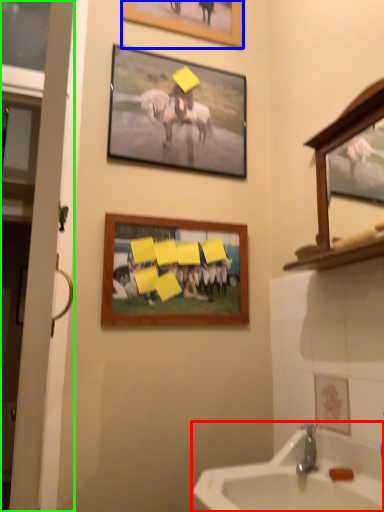
Question: Which object is positioned closest to sink (highlighted by a red box)? Select from picture frame (highlighted by a blue box) and door (highlighted by a green box).

Choices:
 (A) picture frame
 (B) door

Answer: (B)